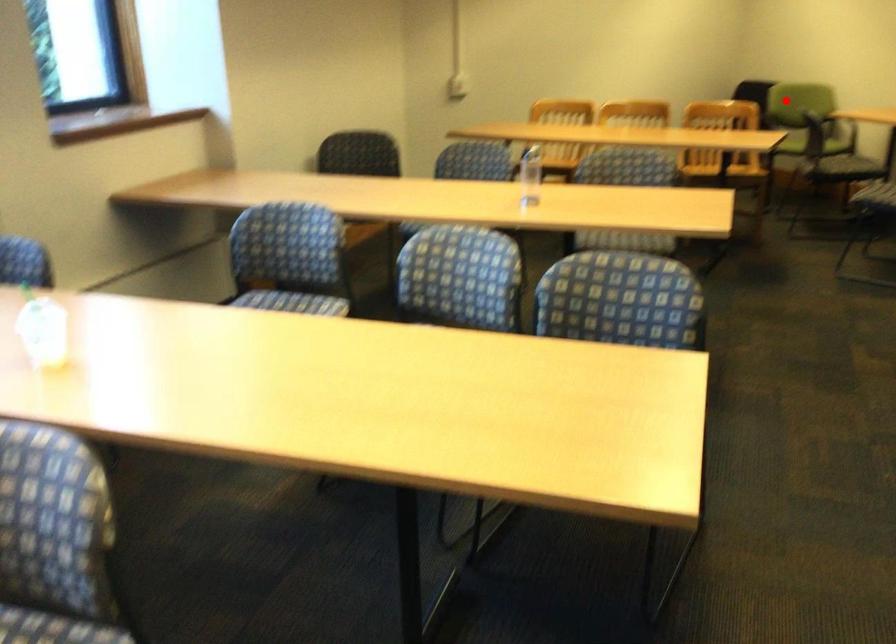
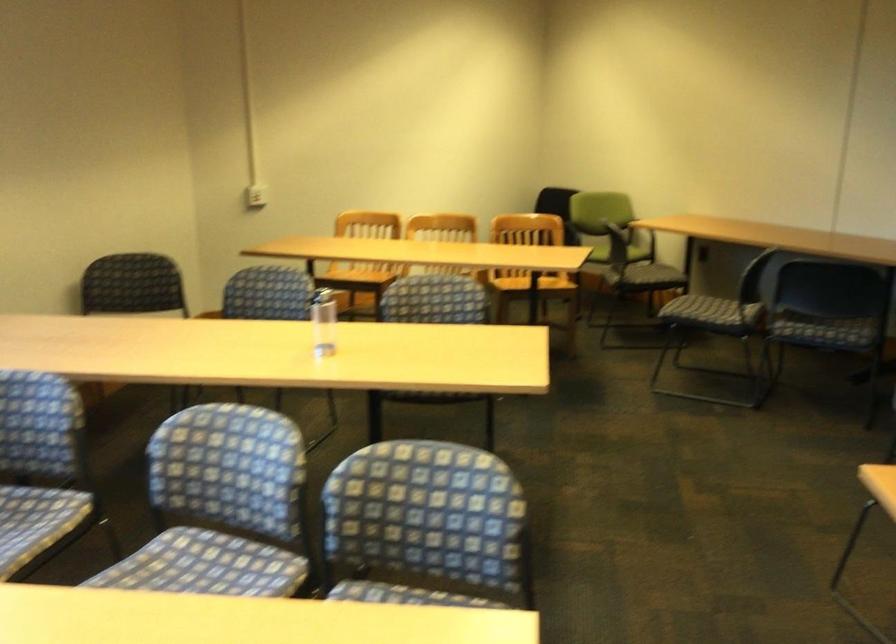
The point at the highlighted location is marked in the first image. Where is the corresponding point in the second image?

(589, 221)